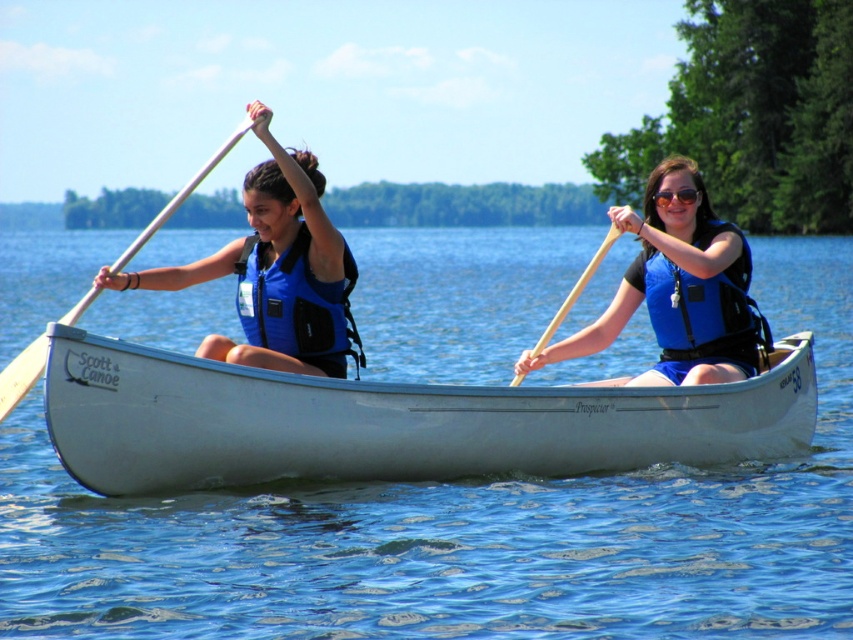
You are a safety inspector checking the equipment on the canoe. You notice the blue life vest at center and the wooden paddle at left. Which item takes up more space in the canoe?

The wooden paddle at left takes up more space than the blue life vest at center because the blue life vest at center occupies less space than wooden paddle at left.

You are a safety inspector checking the proper placement of safety gear in the canoe. The blue matte life vest at left and the matte black goggles at center are both essential items. According to safety regulations, life vests must be placed above any other gear. Is the current arrangement compliant with safety standards?

The blue matte life vest at left is located below the matte black goggles at center, which violates safety regulations since life vests must be placed above other gear. The current arrangement is not compliant.